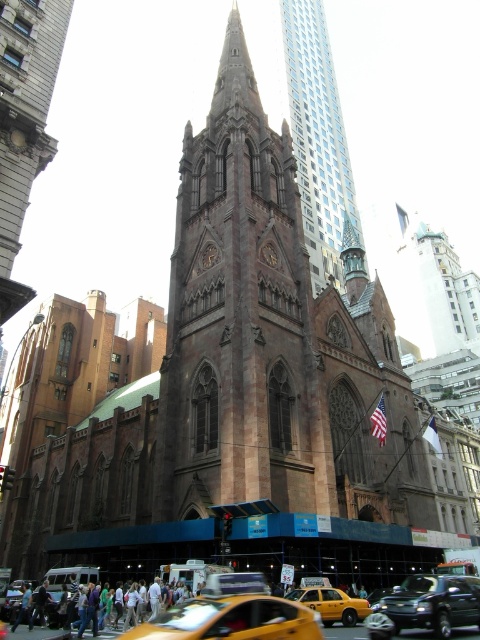
You are a delivery driver who needs to park your vehicle in a narrow alley that can only accommodate vehicles up to the width of the yellow matte taxi at center. You have a shiny black sedan at center. Can you safely park your vehicle in this alley?

The shiny black sedan at center is wider than the yellow matte taxi at center, so it cannot safely fit into the alley designed for vehicles up to the width of the yellow matte taxi at center.

You are standing at the base of the church and want to walk towards the yellow taxi. There are two points marked on the ground labeled point (x=268, y=632) and point (x=324, y=620). Which point should you step on first to reach the taxi quickly?

Point (x=268, y=632) is in front of point (x=324, y=620), so you should step on point (x=268, y=632) first to reach the yellow taxi quickly.

You are a pedestrian standing at the edge of the road looking towards the church. You see the yellow matte taxi at lower center and the shiny black sedan at center. Which vehicle is closer to you?

The yellow matte taxi at lower center is closer to you because it is positioned in front of the shiny black sedan at center.